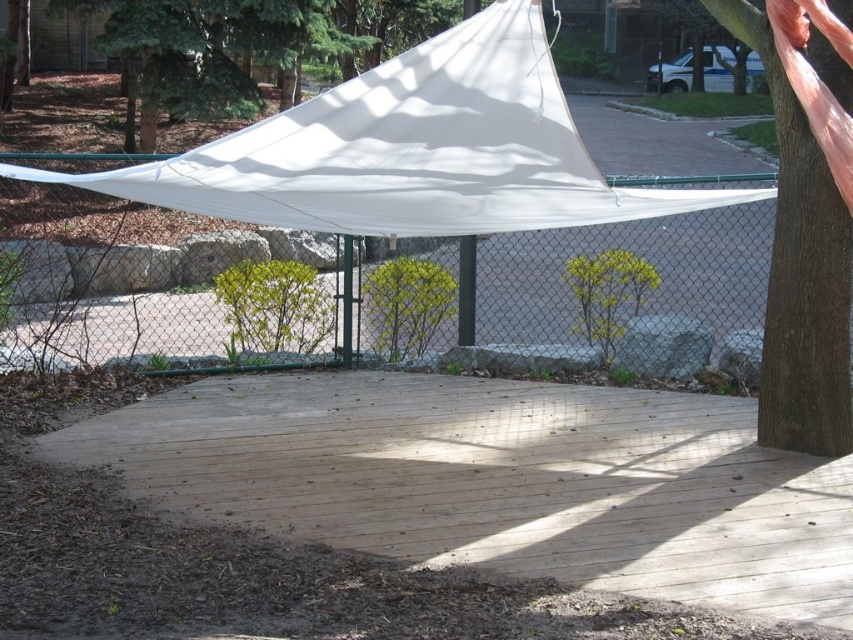
Question: Can you confirm if white mesh fence at center is wider than white fabric canopy at upper center?

Choices:
 (A) yes
 (B) no

Answer: (B)

Question: Observing the image, what is the correct spatial positioning of white mesh fence at center in reference to white fabric canopy at upper center?

Choices:
 (A) above
 (B) below

Answer: (B)

Question: Which object appears closest to the camera in this image?

Choices:
 (A) white mesh fence at center
 (B) white fabric canopy at upper center
 (C) natural wood deck at center

Answer: (B)

Question: Which of the following is the farthest from the observer?

Choices:
 (A) white mesh fence at center
 (B) white fabric canopy at upper center

Answer: (A)

Question: Considering the relative positions of white mesh fence at center and white fabric canopy at upper center in the image provided, where is white mesh fence at center located with respect to white fabric canopy at upper center?

Choices:
 (A) left
 (B) right

Answer: (A)

Question: Which object appears closest to the camera in this image?

Choices:
 (A) natural wood deck at center
 (B) white fabric canopy at upper center

Answer: (B)